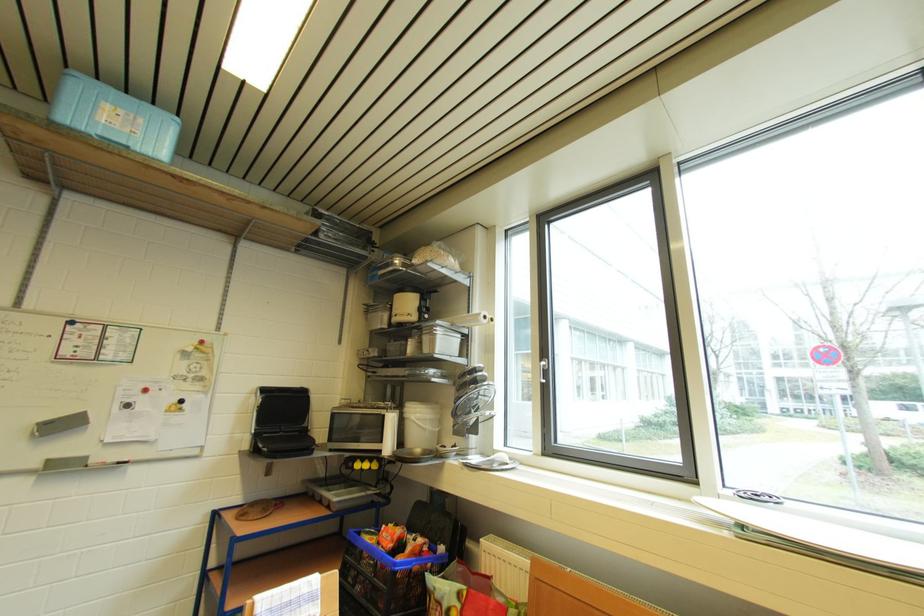
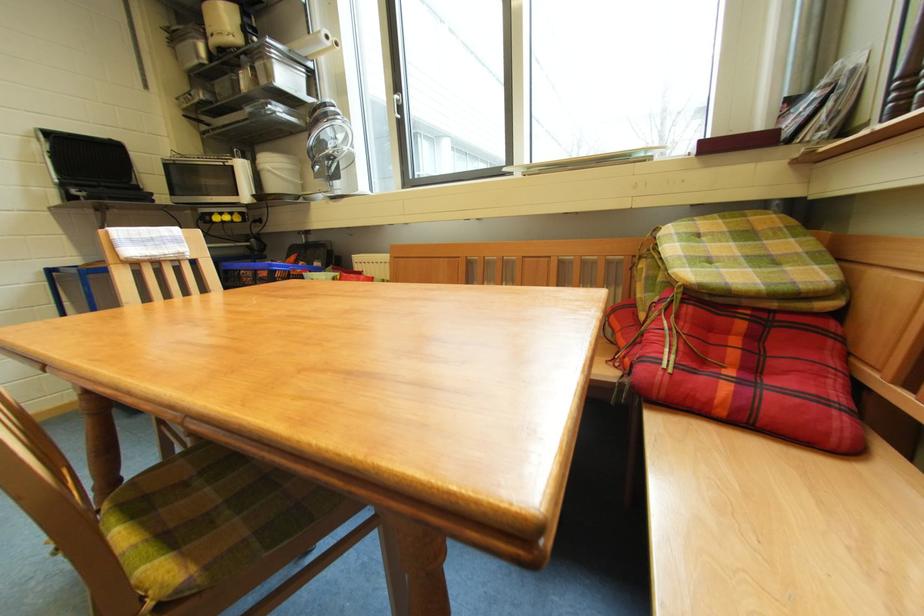
Locate, in the second image, the point that corresponds to point (546, 369) in the first image.

(402, 102)